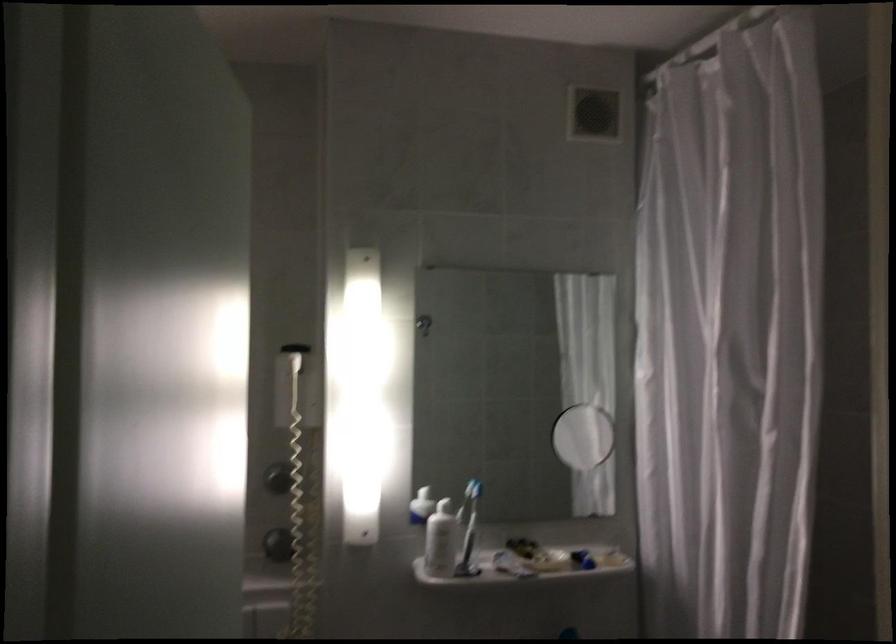
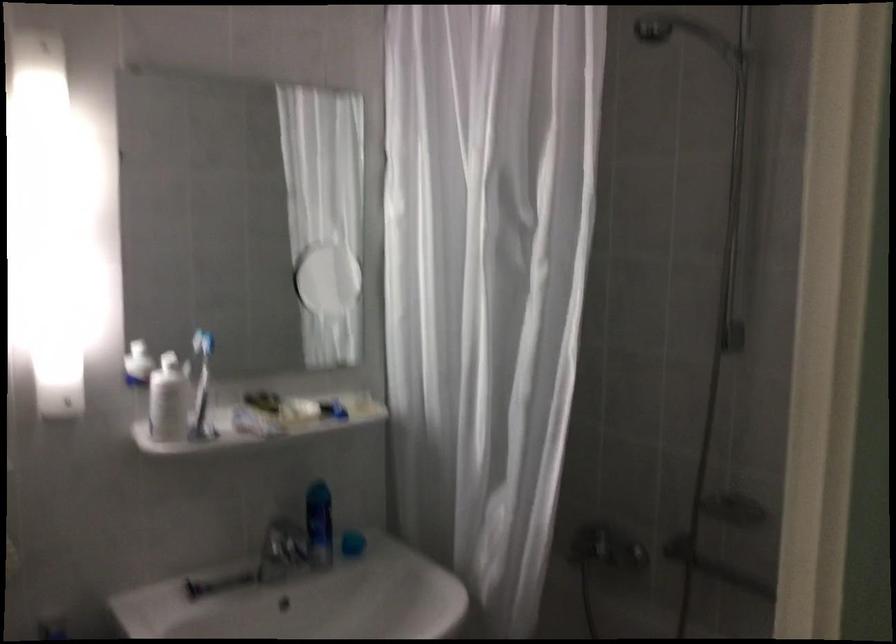
The point at (423,323) is marked in the first image. Where is the corresponding point in the second image?

(116, 155)